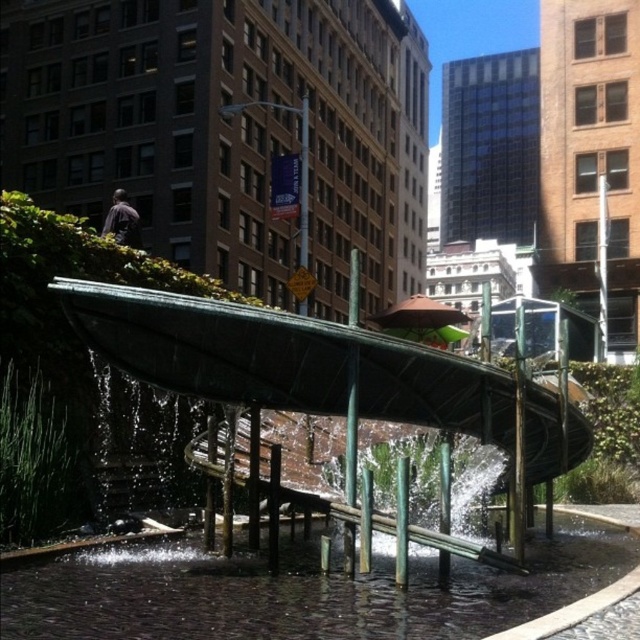
Question: Is clear water at center to the left of green metallic water feature at center from the viewer's perspective?

Choices:
 (A) no
 (B) yes

Answer: (B)

Question: Which point is closer to the camera taking this photo?

Choices:
 (A) (506, 444)
 (B) (433, 609)

Answer: (B)

Question: Which object appears closest to the camera in this image?

Choices:
 (A) green metallic water feature at center
 (B) clear water at center

Answer: (B)

Question: Is clear water at center closer to camera compared to green metallic water feature at center?

Choices:
 (A) yes
 (B) no

Answer: (A)

Question: Does clear water at center have a smaller size compared to green metallic water feature at center?

Choices:
 (A) no
 (B) yes

Answer: (B)

Question: Among these objects, which one is farthest from the camera?

Choices:
 (A) clear water at center
 (B) green metallic water feature at center

Answer: (B)